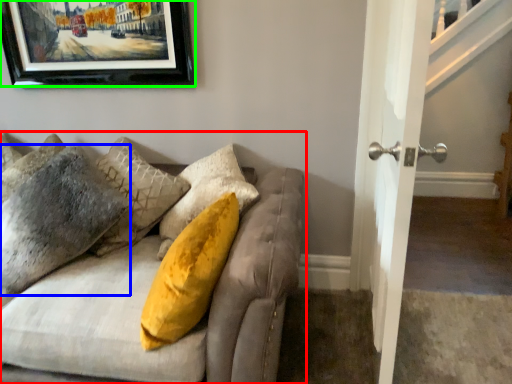
Question: Which object is the closest to the studio couch (highlighted by a red box)? Choose among these: pillow (highlighted by a blue box) or picture frame (highlighted by a green box).

Choices:
 (A) pillow
 (B) picture frame

Answer: (A)